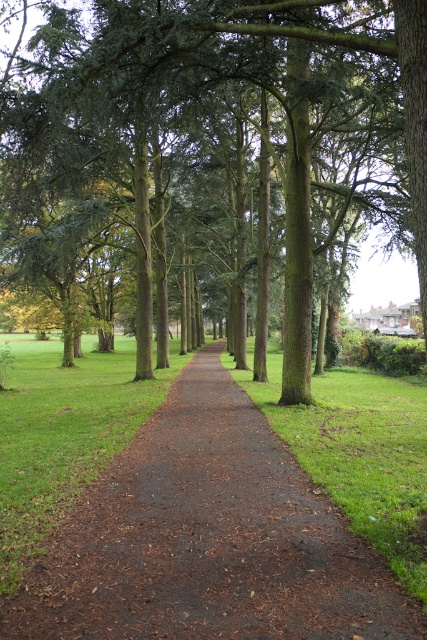
You are a hiker walking along the brown dirt path at center in the park. You notice the green textured tree at center nearby. Which object occupies more space in the scene?

The green textured tree at center has a larger size compared to the brown dirt path at center, so the tree occupies more space in the scene.

You are standing at the point marked by the coordinates point (210,150) in the park. Looking around, you see the green textured tree at center. Based on your position, which direction should you walk to reach the pathway lined with tall, slender trees?

The point (210,150) is located at the green textured tree at center. To reach the pathway lined with tall, slender trees, you should walk away from the tree towards the edges of the park where the pathway is situated.

You are standing at the center of the park and want to locate the green textured tree at center. According to the coordinates provided, in which direction should you move to reach it?

The green textured tree at center is located at coordinates point (210, 150). Since you are at the center, you should move towards the direction of the coordinates to reach it.